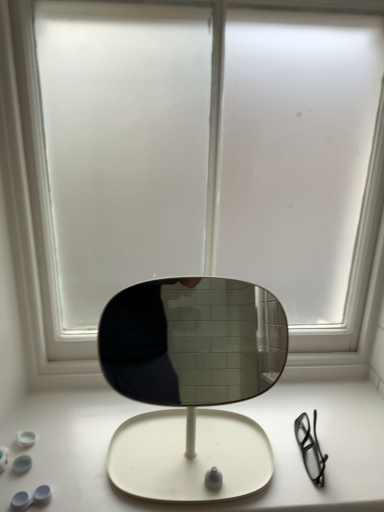
This screenshot has height=512, width=384. What do you see at coordinates (220, 408) in the screenshot?
I see `white matte table at center` at bounding box center [220, 408].

The image size is (384, 512). Identify the location of white matte table at center. (220, 408).

In order to face white matte table at center, should I rotate leftwards or rightwards?

Turn right approximately 1.232 degrees to face it.

This screenshot has height=512, width=384. Describe the element at coordinates (33, 212) in the screenshot. I see `frosted glass window at center` at that location.

You are a GUI agent. You are given a task and a screenshot of the screen. Output one action in this format:
    pyautogui.click(x=<x>, y=<y>)
    Task: Click on the frosted glass window at center
    This screenshot has height=512, width=384.
    Given the screenshot: What is the action you would take?
    pyautogui.click(x=33, y=212)

Locate an element on the screen. white matte table at center is located at coordinates (220, 408).

Does frosted glass window at center appear on the left side of white matte table at center?

No, frosted glass window at center is not to the left of white matte table at center.

Which object is closer to the camera, frosted glass window at center or white matte table at center?

frosted glass window at center is in front.

Which is less distant, (89, 367) or (137, 505)?

Point (89, 367) is positioned farther from the camera compared to point (137, 505).

From the image's perspective, is frosted glass window at center over white matte table at center?

Indeed, from the image's perspective, frosted glass window at center is shown above white matte table at center.

From a real-world perspective, is frosted glass window at center physically above white matte table at center?

Yes, from a real-world perspective, frosted glass window at center is above white matte table at center.

Is frosted glass window at center wider or thinner than white matte table at center?

In the image, frosted glass window at center appears to be more narrow than white matte table at center.

Considering the sizes of objects frosted glass window at center and white matte table at center in the image provided, who is taller, frosted glass window at center or white matte table at center?

Standing taller between the two is frosted glass window at center.

Can you confirm if frosted glass window at center is bigger than white matte table at center?

Indeed, frosted glass window at center has a larger size compared to white matte table at center.

From the picture: Is frosted glass window at center inside the boundaries of white matte table at center, or outside?

frosted glass window at center is outside white matte table at center.

Can you see frosted glass window at center touching white matte table at center?

frosted glass window at center and white matte table at center are clearly separated.

Looking at this image, is white matte table at center at the back of frosted glass window at center?

No, frosted glass window at center is not facing the opposite direction of white matte table at center.

Where is `window located above the white matte table at center (from a real-world perspective)`? window located above the white matte table at center (from a real-world perspective) is located at coordinates (33, 212).

Based on their positions, is white matte table at center located to the left or right of frosted glass window at center?

In the image, white matte table at center appears on the left side of frosted glass window at center.

In the image, is white matte table at center positioned in front of or behind frosted glass window at center?

In the image, white matte table at center appears behind frosted glass window at center.

Is point (306, 392) farther from camera compared to point (345, 339)?

No, (306, 392) is closer to viewer.

From the image's perspective, is white matte table at center positioned above or below frosted glass window at center?

Clearly, from the image's perspective, white matte table at center is below frosted glass window at center.

From a real-world perspective, which is physically below, white matte table at center or frosted glass window at center?

From a 3D spatial view, white matte table at center is below.

In terms of width, does white matte table at center look wider or thinner when compared to frosted glass window at center?

In the image, white matte table at center appears to be wider than frosted glass window at center.

In terms of height, does white matte table at center look taller or shorter compared to frosted glass window at center?

In the image, white matte table at center appears to be shorter than frosted glass window at center.

Who is bigger, white matte table at center or frosted glass window at center?

Bigger between the two is frosted glass window at center.

Could frosted glass window at center be considered to be inside white matte table at center?

No, frosted glass window at center is not surrounded by white matte table at center.

Is white matte table at center in contact with frosted glass window at center?

No, white matte table at center is not beside frosted glass window at center.

Is frosted glass window at center at the back of white matte table at center?

No.

What's the angular difference between white matte table at center and frosted glass window at center's facing directions?

There is a 1.3-degree angle between the facing directions of white matte table at center and frosted glass window at center.

Where is `table top lying behind the frosted glass window at center`? The width and height of the screenshot is (384, 512). table top lying behind the frosted glass window at center is located at coordinates (220, 408).

The width and height of the screenshot is (384, 512). I want to click on table top lying behind the frosted glass window at center, so click(220, 408).

The image size is (384, 512). I want to click on table top below the frosted glass window at center (from a real-world perspective), so click(x=220, y=408).